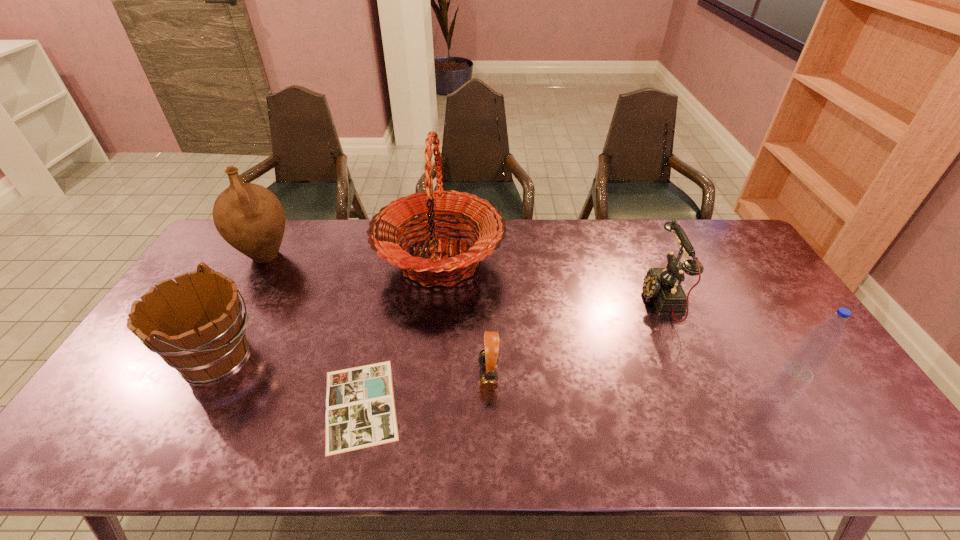
Where is `object that is the nearest to the rightmost object`? The image size is (960, 540). object that is the nearest to the rightmost object is located at coordinates (663, 285).

Find the location of `blank space that satisfies the following two spatial constraints: 1. on the front side of the pitcher; 2. on the left side of the water bottle`. blank space that satisfies the following two spatial constraints: 1. on the front side of the pitcher; 2. on the left side of the water bottle is located at coordinates click(200, 372).

Identify the location of blank area in the image that satisfies the following two spatial constraints: 1. with the handle on the wine bucket; 2. on the back side of the rightmost object. (208, 372).

Identify the location of vacant region that satisfies the following two spatial constraints: 1. with the handle on the wine bucket; 2. on the back side of the shortest object. This screenshot has width=960, height=540. (190, 404).

The image size is (960, 540). Find the location of `free location that satisfies the following two spatial constraints: 1. on the front side of the shortest object; 2. on the left side of the pitcher`. free location that satisfies the following two spatial constraints: 1. on the front side of the shortest object; 2. on the left side of the pitcher is located at coordinates click(x=180, y=404).